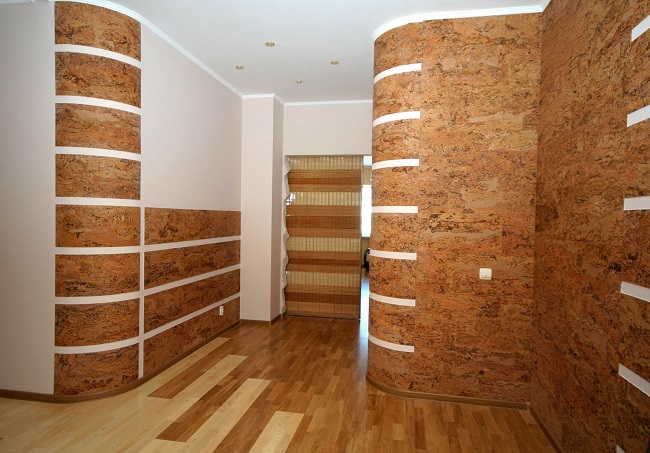
This screenshot has height=453, width=650. I want to click on light floor, so click(276, 431).